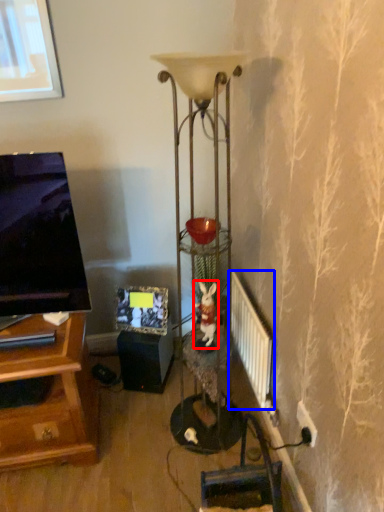
Question: Among these objects, which one is nearest to the camera, animal (highlighted by a red box) or radiator (highlighted by a blue box)?

Choices:
 (A) animal
 (B) radiator

Answer: (B)